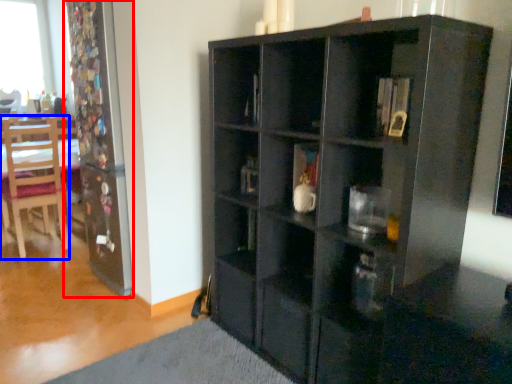
Question: Which object appears closest to the camera in this image, screen door (highlighted by a red box) or chair (highlighted by a blue box)?

Choices:
 (A) screen door
 (B) chair

Answer: (A)